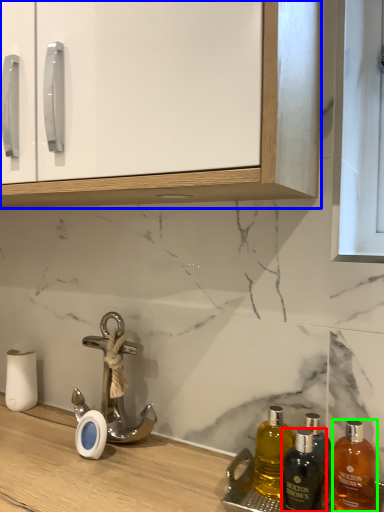
Question: Which is nearer to the bottle (highlighted by a red box)? cabinetry (highlighted by a blue box) or bottle (highlighted by a green box).

Choices:
 (A) cabinetry
 (B) bottle

Answer: (B)